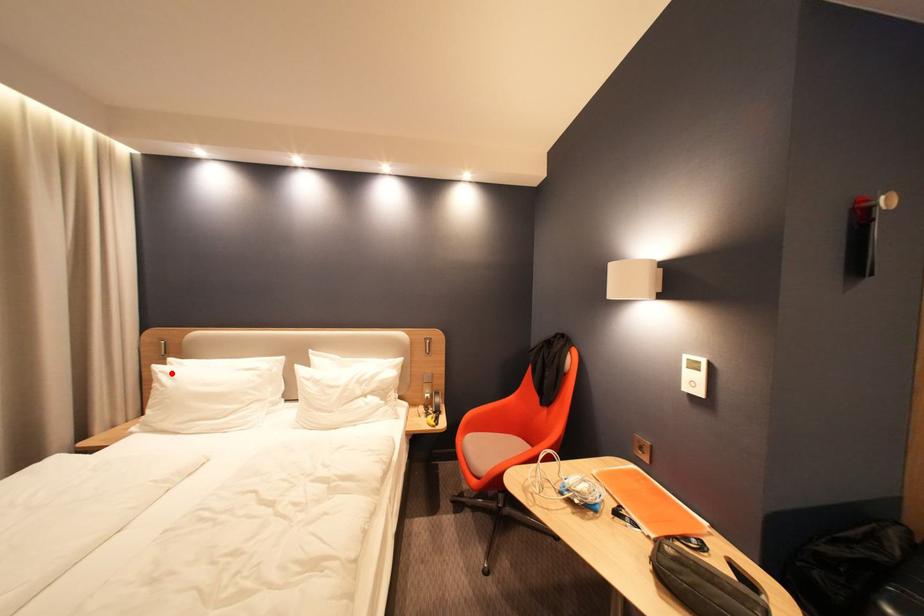
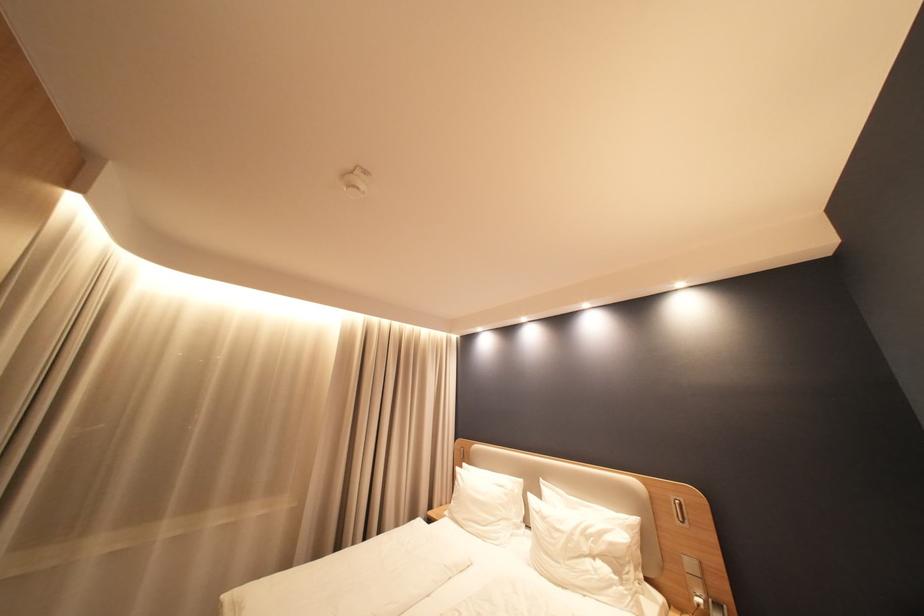
Question: I am providing you with two images of the same scene from different viewpoints. Image1 has a red point marked. In image2, the corresponding 3D location appears at what relative position? Reply with the corresponding letter.

Choices:
 (A) Closer
 (B) Farther

Answer: (B)